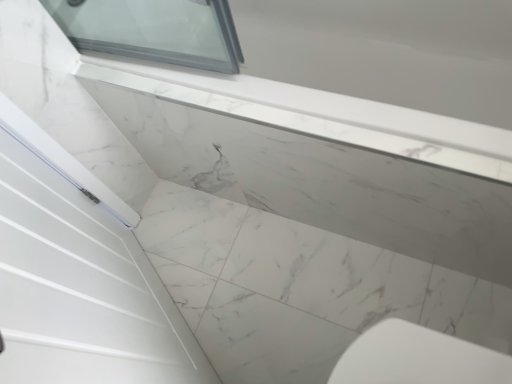
Where is `free space above white marble countertop at upper center (from a real-world perspective)`? The image size is (512, 384). free space above white marble countertop at upper center (from a real-world perspective) is located at coordinates (260, 278).